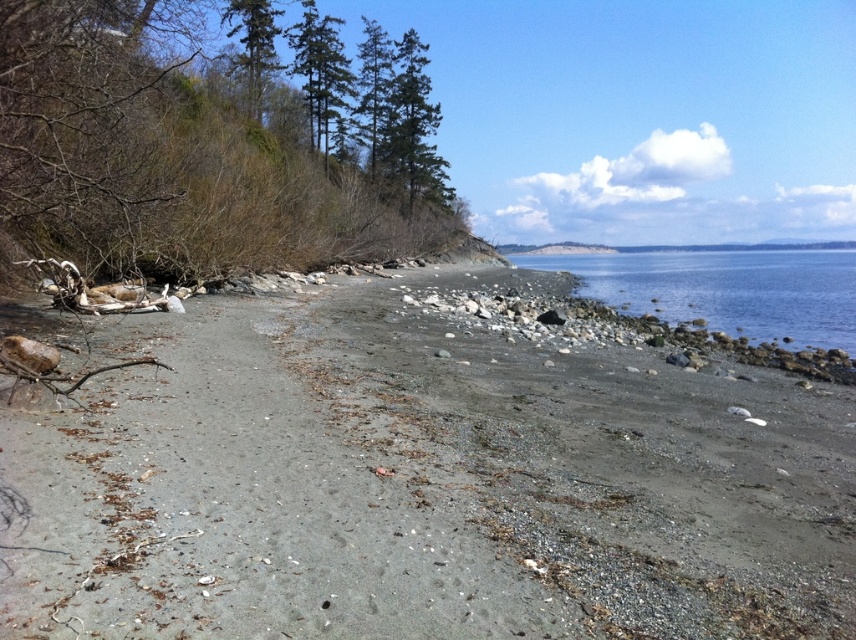
Between point (394, 612) and point (711, 324), which one is positioned behind?

Point (711, 324)

Who is higher up, gray gravel beach at center or clear blue water at center?

clear blue water at center is higher up.

This screenshot has height=640, width=856. I want to click on gray gravel beach at center, so click(419, 481).

I want to click on gray gravel beach at center, so click(x=419, y=481).